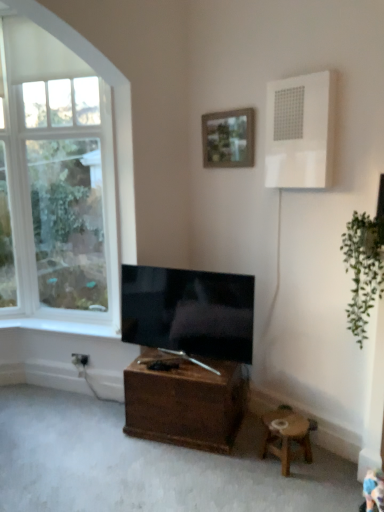
Question: From a real-world perspective, does white glass window at upper left sit lower than white plastic air conditioner at upper right?

Choices:
 (A) yes
 (B) no

Answer: (A)

Question: Is white glass window at upper left closer to camera compared to white plastic air conditioner at upper right?

Choices:
 (A) yes
 (B) no

Answer: (B)

Question: Is white glass window at upper left beside white plastic air conditioner at upper right?

Choices:
 (A) yes
 (B) no

Answer: (B)

Question: Is white glass window at upper left at the left side of white plastic air conditioner at upper right?

Choices:
 (A) no
 (B) yes

Answer: (B)

Question: Considering the relative sizes of white glass window at upper left and white plastic air conditioner at upper right in the image provided, is white glass window at upper left bigger than white plastic air conditioner at upper right?

Choices:
 (A) yes
 (B) no

Answer: (A)

Question: Considering the positions of point (279, 430) and point (246, 114), is point (279, 430) closer or farther from the camera than point (246, 114)?

Choices:
 (A) closer
 (B) farther

Answer: (A)

Question: In terms of size, does wooden stool at lower right appear bigger or smaller than wooden framed picture at upper center?

Choices:
 (A) small
 (B) big

Answer: (B)

Question: From a real-world perspective, is wooden stool at lower right physically located above or below wooden framed picture at upper center?

Choices:
 (A) below
 (B) above

Answer: (A)

Question: From the image's perspective, relative to wooden framed picture at upper center, is wooden stool at lower right above or below?

Choices:
 (A) above
 (B) below

Answer: (B)

Question: From the image's perspective, is white glass window at upper left located above or below white plastic air conditioner at upper right?

Choices:
 (A) below
 (B) above

Answer: (A)

Question: Is white glass window at upper left bigger or smaller than white plastic air conditioner at upper right?

Choices:
 (A) big
 (B) small

Answer: (A)

Question: Is white glass window at upper left wider or thinner than white plastic air conditioner at upper right?

Choices:
 (A) thin
 (B) wide

Answer: (A)

Question: Considering the positions of white glass window at upper left and white plastic air conditioner at upper right in the image, is white glass window at upper left taller or shorter than white plastic air conditioner at upper right?

Choices:
 (A) tall
 (B) short

Answer: (A)

Question: From the image's perspective, is white glass window at upper left above or below matte black tv at center?

Choices:
 (A) below
 (B) above

Answer: (B)

Question: Would you say white glass window at upper left is inside or outside matte black tv at center?

Choices:
 (A) inside
 (B) outside

Answer: (B)